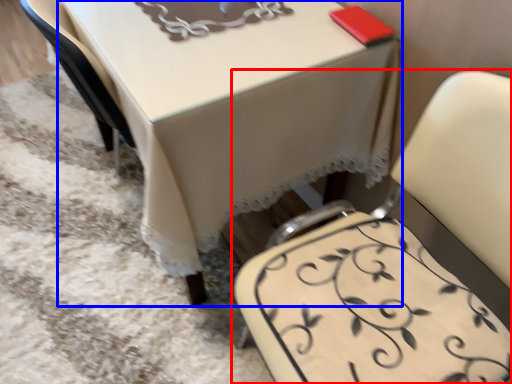
Question: Which of the following is the farthest to the observer, chair (highlighted by a red box) or table (highlighted by a blue box)?

Choices:
 (A) chair
 (B) table

Answer: (B)